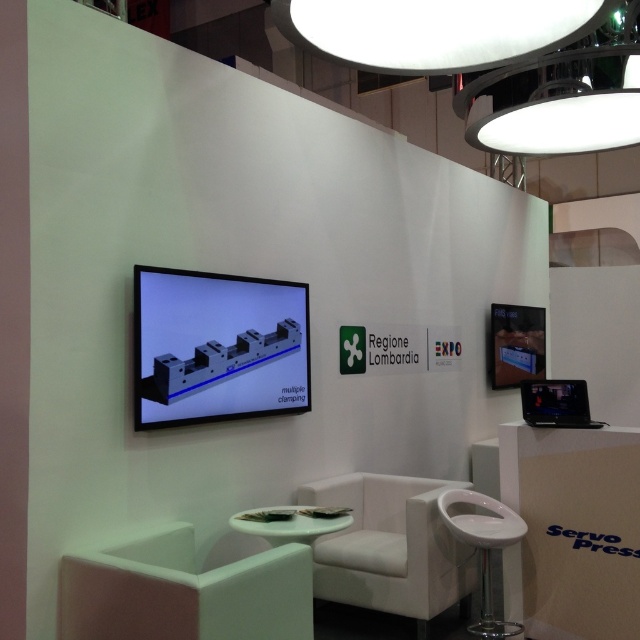
You are a visitor at the EXPO and want to sit down to rest. You see the white matte chair at lower left and the white fabric chair at center. Which chair is closer to the large flat screen monitor displayed on the left side of the image?

The white fabric chair at center is closer to the large flat screen monitor on the left side because the distance between the white matte chair at lower left and the white fabric chair at center is 1.43 meters, implying the fabric chair is positioned between the monitor and the matte chair.

You are an event planner setting up a VIP lounge area in the booth. You have two chairs available for seating guests. The white matte chair at lower left and the white fabric chair at center. Which chair should you choose if you want to provide more seating space per guest?

The white fabric chair at center has a greater width than the white matte chair at lower left, so it provides more seating space per guest.